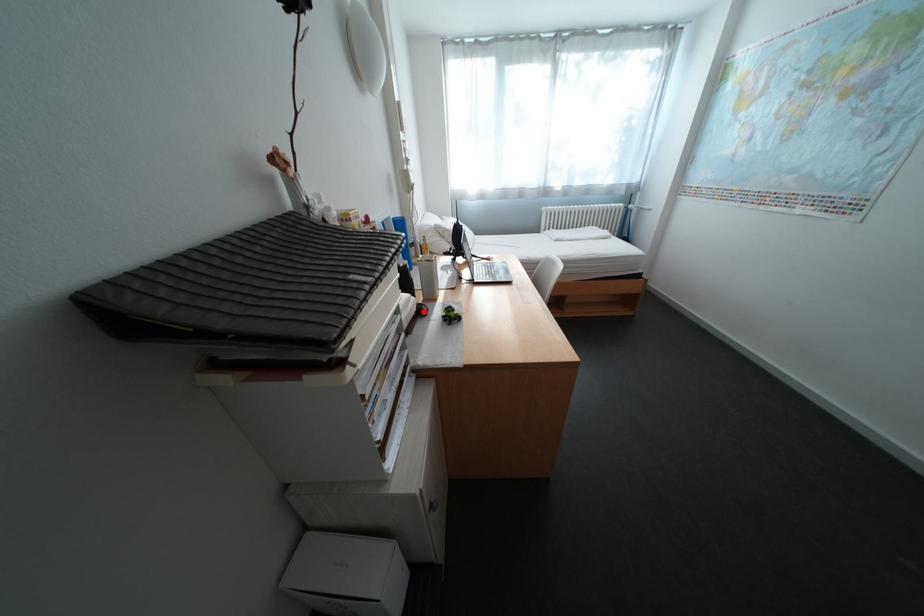
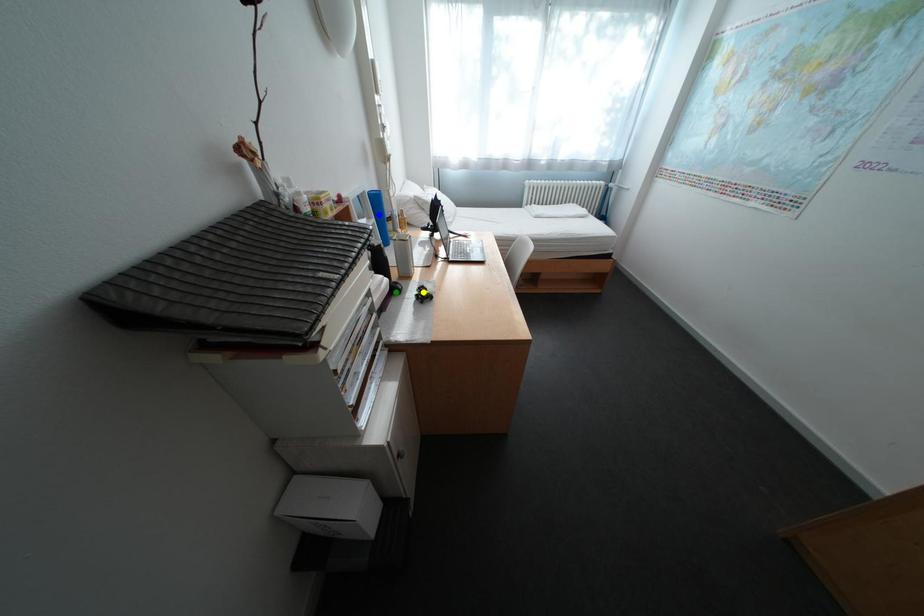
Question: I am providing you with two images of the same scene from different viewpoints. A red point is marked on the first image. You are given multiple points on the second image. Which mark in image 2 goes with the point in image 1?

Choices:
 (A) blue point
 (B) yellow point
 (C) green point

Answer: (C)